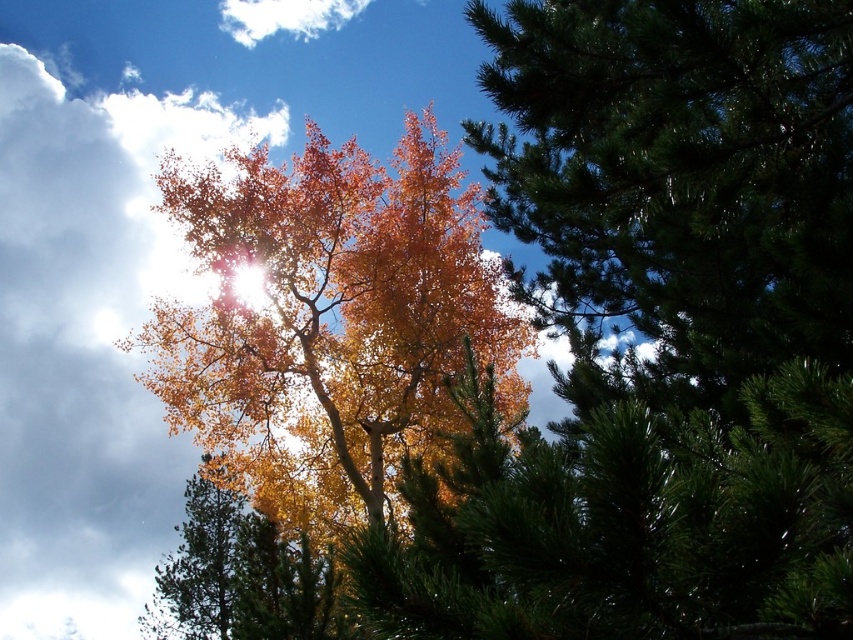
You are standing in the autumn scene and want to pick up the golden leaves at center. Based on their position, where exactly should you look to find them?

The golden leaves at center are located at the coordinates point (329, 321), so you should look towards the center of the image to find them.